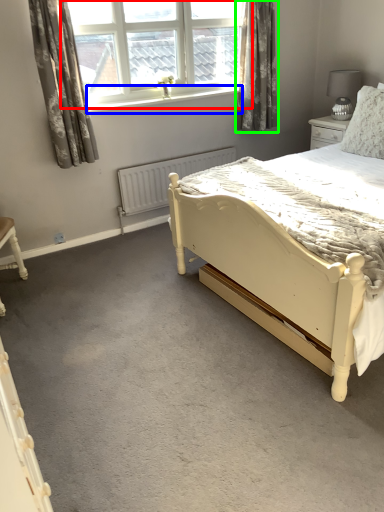
Question: Which object is positioned farthest from window (highlighted by a red box)? Select from window sill (highlighted by a blue box) and curtain (highlighted by a green box).

Choices:
 (A) window sill
 (B) curtain

Answer: (B)